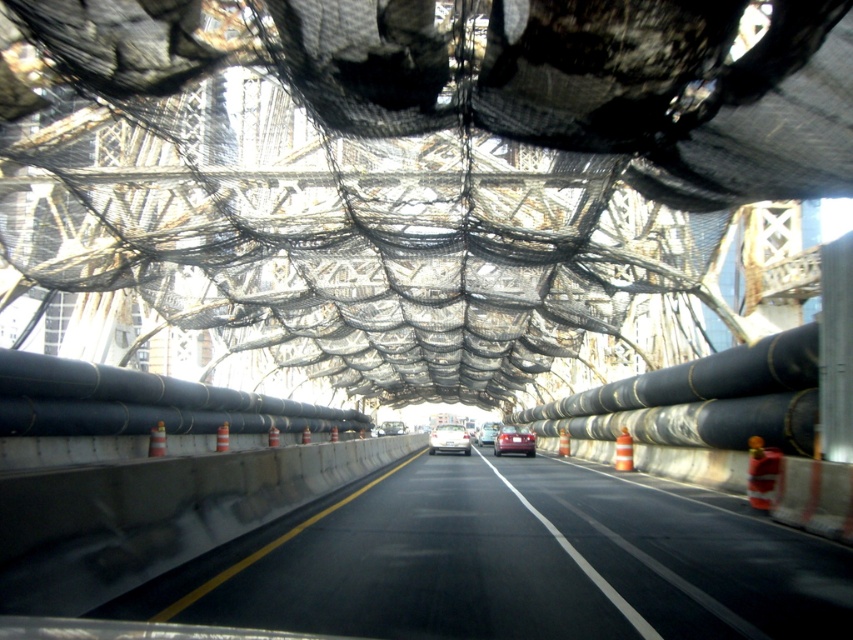
You are a passenger in the white glossy sedan at center and want to know if your car is bigger than the shiny silver sedan at center. Can you tell from the scene?

The white glossy sedan at center has a larger size compared to the shiny silver sedan at center, so yes, the white glossy sedan at center is bigger than the shiny silver sedan at center.

You are driving a car that is 4.5 meters long. You see a point at coordinates point (448, 429) ahead. Can your car safely pass through that point without hitting any obstacles?

The distance of point (448, 429) from viewer is 32.62 meters. Since the car is 4.5 meters long, there is enough space to safely pass through the point as the distance is greater than the car length.

You are a GPS navigation system trying to determine the exact location of the black asphalt highway at center. What coordinates should you report for its position?

The black asphalt highway at center is located at coordinates point (512, 561).